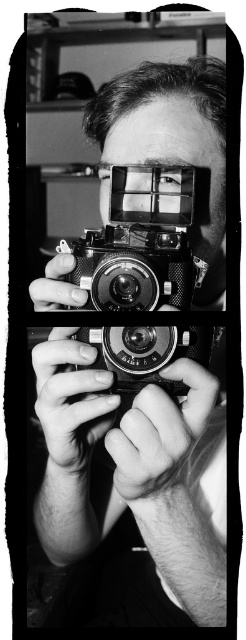
Question: Which point is farther to the camera?

Choices:
 (A) metallic silver film camera at center
 (B) metallic camera at center

Answer: (A)

Question: Which point appears closest to the camera in this image?

Choices:
 (A) (158, 125)
 (B) (190, 337)

Answer: (B)

Question: Does metallic silver film camera at center appear over metallic camera at center?

Choices:
 (A) no
 (B) yes

Answer: (A)

Question: Is metallic silver film camera at center wider than metallic camera at center?

Choices:
 (A) no
 (B) yes

Answer: (A)

Question: Is metallic silver film camera at center smaller than metallic camera at center?

Choices:
 (A) no
 (B) yes

Answer: (B)